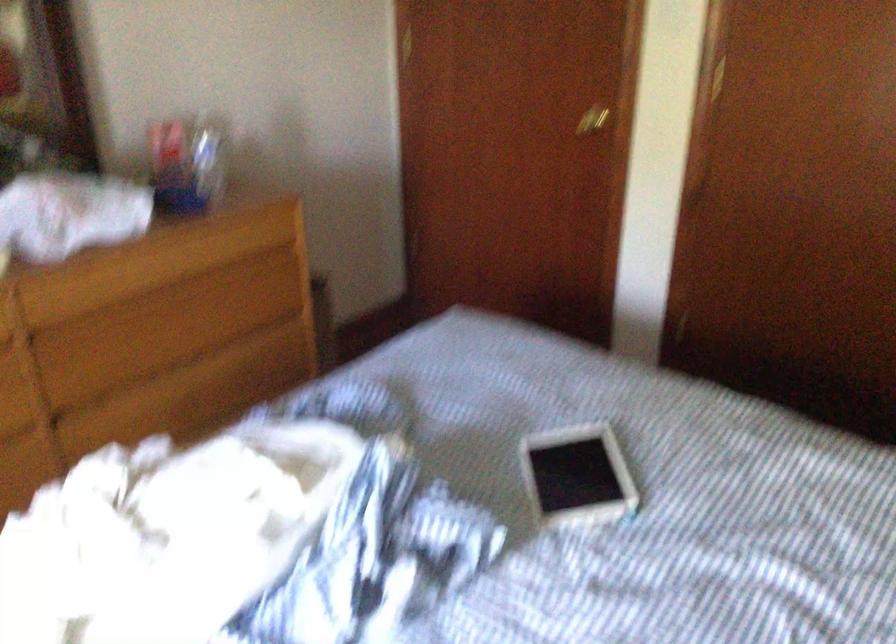
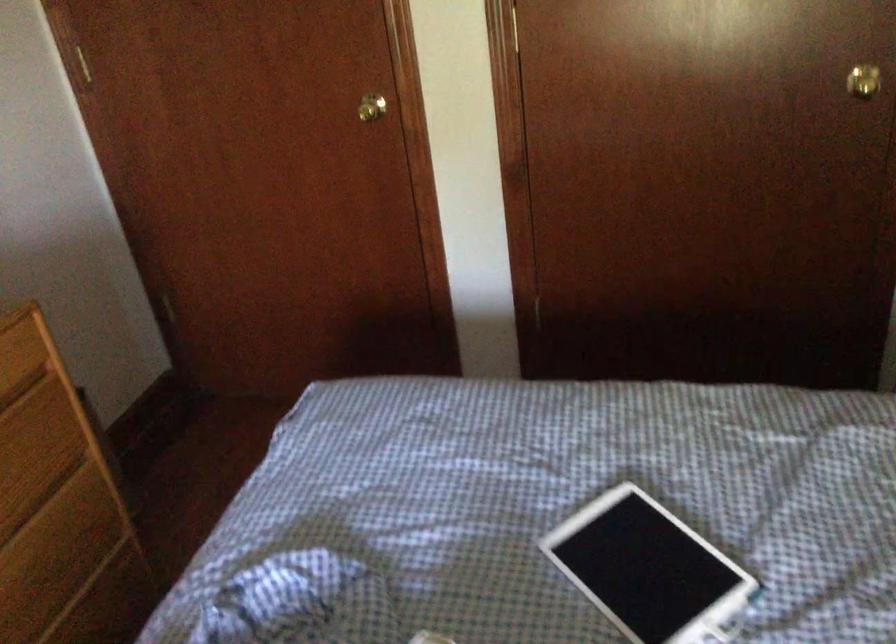
From the picture: In a continuous first-person perspective shot, in which direction is the camera moving?

The cameraman walked toward left, forward.